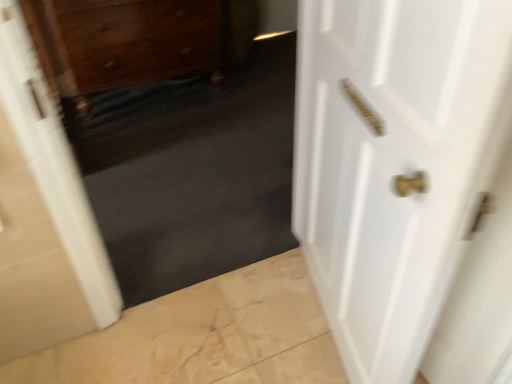
Where is `vacant point to the left of dark matte carpet at center`? This screenshot has height=384, width=512. vacant point to the left of dark matte carpet at center is located at coordinates (147, 243).